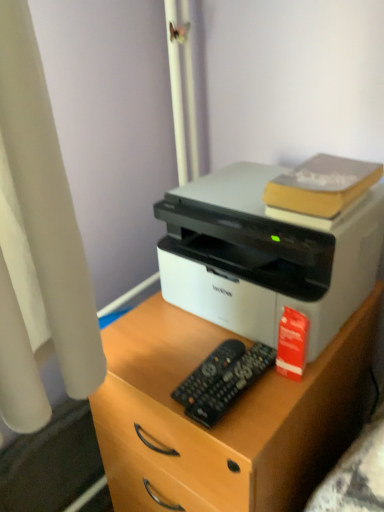
This screenshot has height=512, width=384. I want to click on free space to the back side of black plastic remote at center, marked as the second control in a back-to-front arrangement, so click(x=185, y=335).